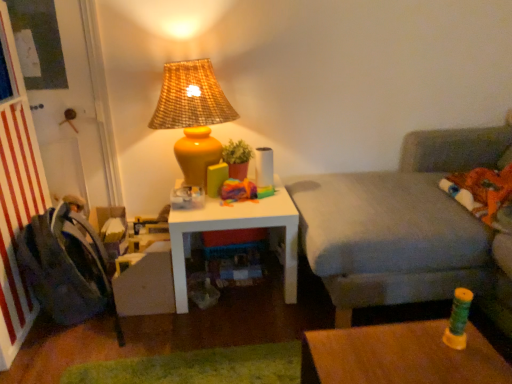
Identify the location of vacant area in front of white matte table at center. (223, 327).